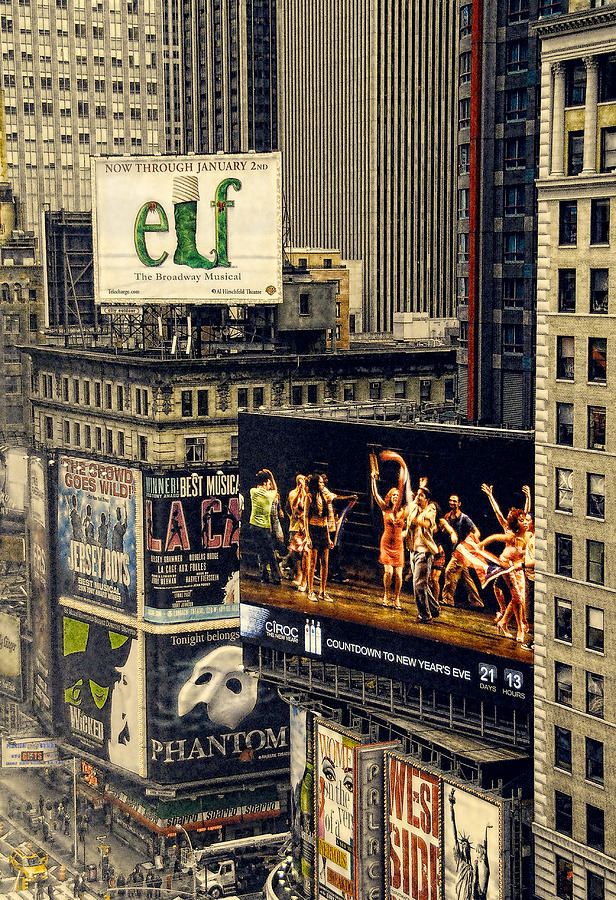
You are a GUI agent. You are given a task and a screenshot of the screen. Output one action in this format:
    pyautogui.click(x=<x>, y=<y>)
    Task: Click on the jersey boys poster
    This screenshot has width=616, height=900.
    Given the screenshot: What is the action you would take?
    pyautogui.click(x=95, y=515)